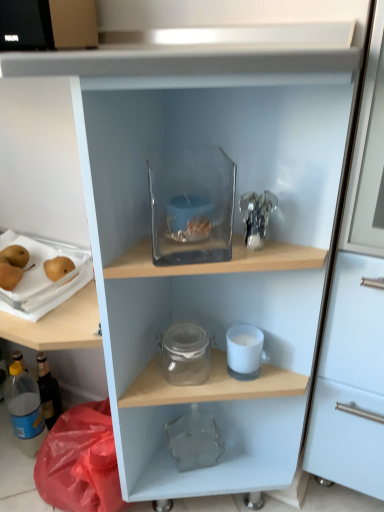
Question: Is translucent plastic tray with pears at left, acting as the 3th appliance starting from the right, situated inside transparent glass container at upper center, arranged as the 2th appliance when viewed from the left, or outside?

Choices:
 (A) inside
 (B) outside

Answer: (B)

Question: Is translucent plastic tray with pears at left, arranged as the 2th appliance when viewed from the top, bigger or smaller than transparent glass container at upper center, arranged as the 2th appliance when viewed from the left?

Choices:
 (A) small
 (B) big

Answer: (A)

Question: Which object is the closest to the translucent plastic bottle at lower left?

Choices:
 (A) transparent glass container at upper center, positioned as the second appliance in right-to-left order
 (B) smooth golden pears at left
 (C) white matte candle at lower center, which appears as the 1th appliance when ordered from the bottom
 (D) translucent plastic tray with pears at left, acting as the 3th appliance starting from the right
 (E) transparent glass jar at middle

Answer: (D)

Question: Considering the real-world distances, which object is farthest from the translucent plastic bottle at lower left?

Choices:
 (A) transparent glass container at upper center, arranged as the 2th appliance when viewed from the left
 (B) transparent glass jar at middle
 (C) translucent plastic tray with pears at left, acting as the 3th appliance starting from the right
 (D) smooth golden pears at left
 (E) white matte candle at lower center, the 3th appliance positioned from the left

Answer: (A)